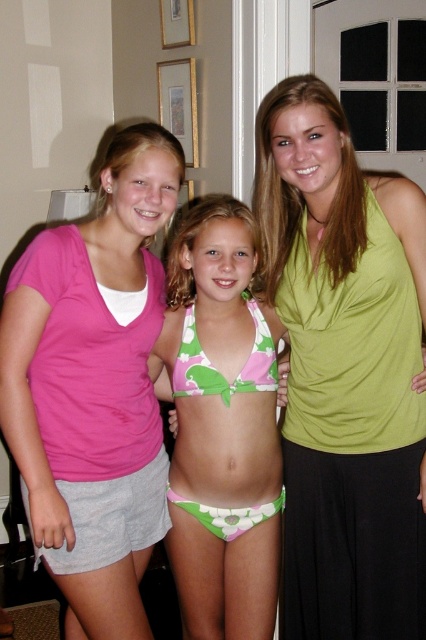
You are planning to take a photo of the green fabric tank top at upper right and the green floral bikini at center. Since both are green, you want to ensure they are clearly distinguishable in the final image. Based on their positions, which one is lower in the frame?

The green fabric tank top at upper right is positioned under the green floral bikini at center, so it is lower in the frame.